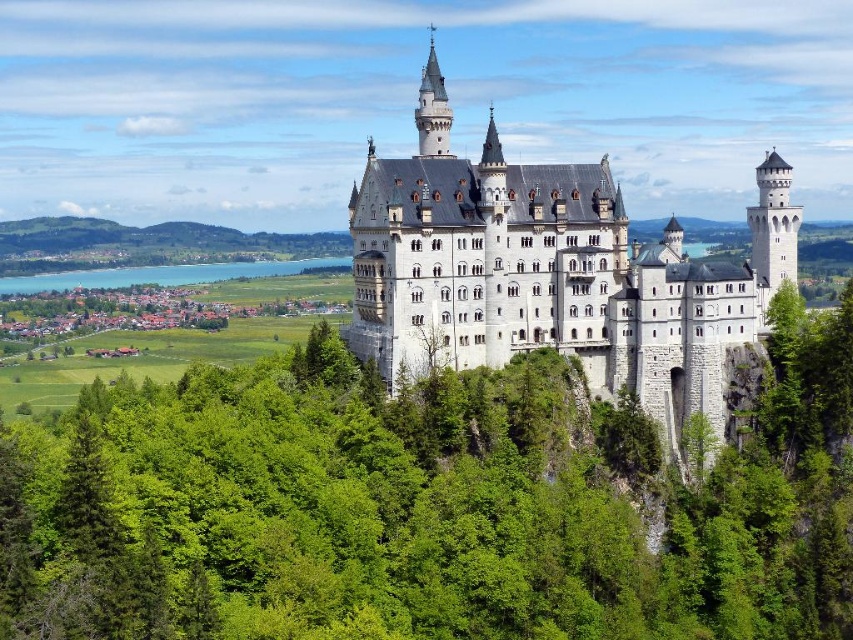
Can you confirm if green leafy tree at center is taller than white stone castle at center?

No, green leafy tree at center is not taller than white stone castle at center.

Is green leafy tree at center further to camera compared to white stone castle at center?

No, green leafy tree at center is closer to the viewer.

Is point (126, 525) closer to camera compared to point (515, 234)?

Yes, it is.

This screenshot has height=640, width=853. I want to click on green leafy tree at center, so click(x=428, y=504).

Who is shorter, white stone castle at center or turquoise glassy water at lower left?

turquoise glassy water at lower left

Does point (769, 186) come behind point (212, 266)?

No, (769, 186) is in front of (212, 266).

Find the location of `white stone castle at center`. white stone castle at center is located at coordinates (552, 273).

The height and width of the screenshot is (640, 853). What do you see at coordinates (428, 504) in the screenshot?
I see `green leafy tree at center` at bounding box center [428, 504].

Does point (517, 564) come farther from viewer compared to point (189, 266)?

No, it is in front of (189, 266).

Is point (323, 477) behind point (305, 262)?

No, (323, 477) is closer to viewer.

This screenshot has width=853, height=640. Find the location of `green leafy tree at center`. green leafy tree at center is located at coordinates coord(428,504).